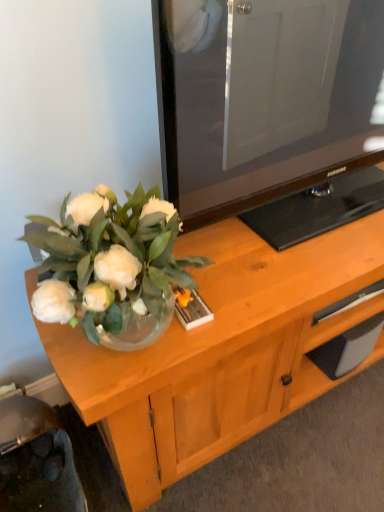
Question: From a real-world perspective, is wooden cabinet at center positioned under black rubber drawer at lower right based on gravity?

Choices:
 (A) yes
 (B) no

Answer: (A)

Question: Does wooden cabinet at center contain black rubber drawer at lower right?

Choices:
 (A) no
 (B) yes

Answer: (A)

Question: Is wooden cabinet at center to the right of black rubber drawer at lower right from the viewer's perspective?

Choices:
 (A) yes
 (B) no

Answer: (B)

Question: From the image's perspective, is wooden cabinet at center below black rubber drawer at lower right?

Choices:
 (A) yes
 (B) no

Answer: (A)

Question: Considering the relative positions of wooden cabinet at center and black rubber drawer at lower right in the image provided, is wooden cabinet at center to the left of black rubber drawer at lower right from the viewer's perspective?

Choices:
 (A) no
 (B) yes

Answer: (B)

Question: Is wooden cabinet at center positioned in front of black rubber drawer at lower right?

Choices:
 (A) yes
 (B) no

Answer: (A)

Question: Is black rubber drawer at lower right facing away from metallic silver swivel chair at lower left?

Choices:
 (A) yes
 (B) no

Answer: (B)

Question: Is black rubber drawer at lower right closer to camera compared to metallic silver swivel chair at lower left?

Choices:
 (A) no
 (B) yes

Answer: (A)

Question: From the image's perspective, does black rubber drawer at lower right appear higher than metallic silver swivel chair at lower left?

Choices:
 (A) no
 (B) yes

Answer: (B)

Question: From a real-world perspective, is black rubber drawer at lower right over metallic silver swivel chair at lower left?

Choices:
 (A) no
 (B) yes

Answer: (B)

Question: From a real-world perspective, is black rubber drawer at lower right physically below metallic silver swivel chair at lower left?

Choices:
 (A) yes
 (B) no

Answer: (B)

Question: Can you confirm if black rubber drawer at lower right is thinner than metallic silver swivel chair at lower left?

Choices:
 (A) yes
 (B) no

Answer: (A)

Question: Can you see black rubber drawer at lower right touching wooden cabinet at center?

Choices:
 (A) yes
 (B) no

Answer: (B)